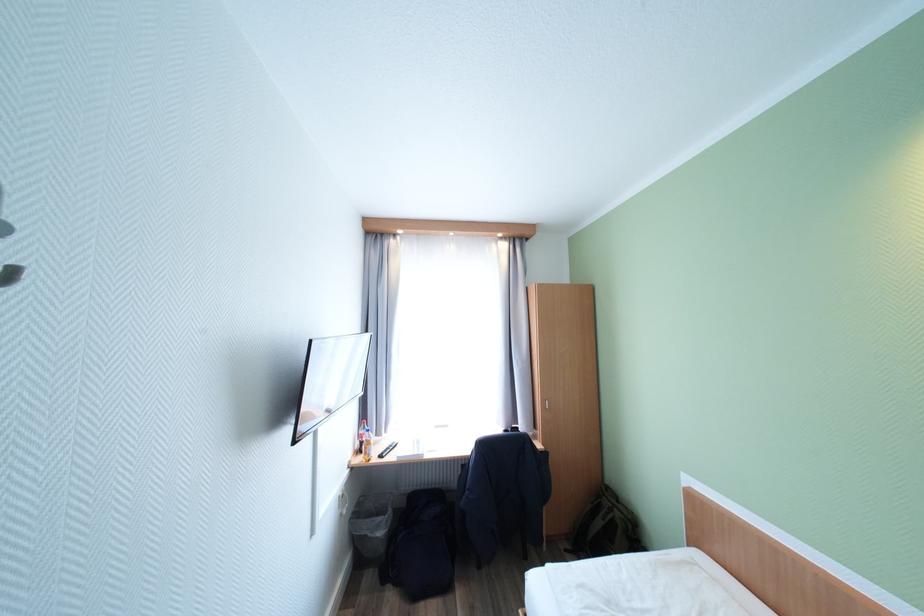
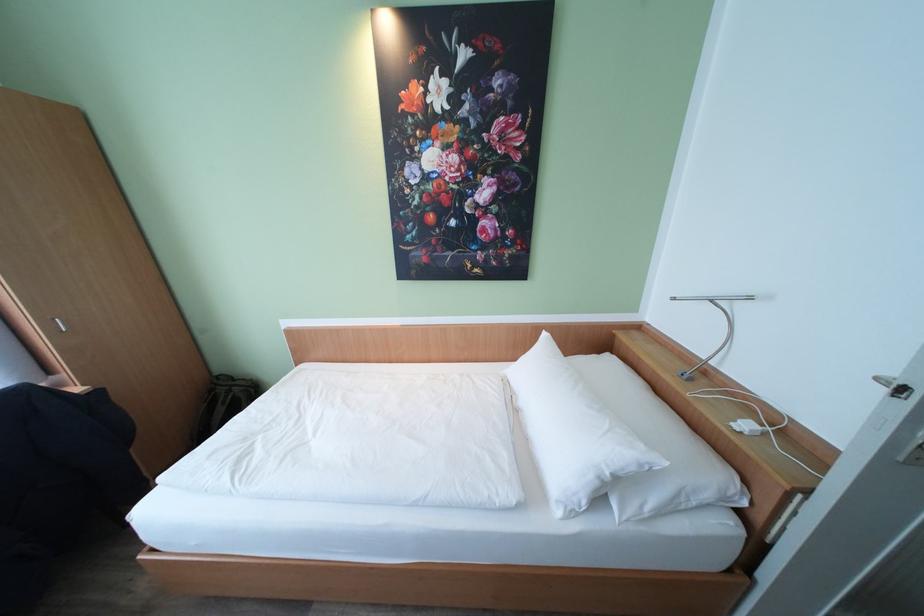
Based on the photo, first-person continuous shooting, in which direction is the camera rotating?

The camera's rotation is toward right-down.